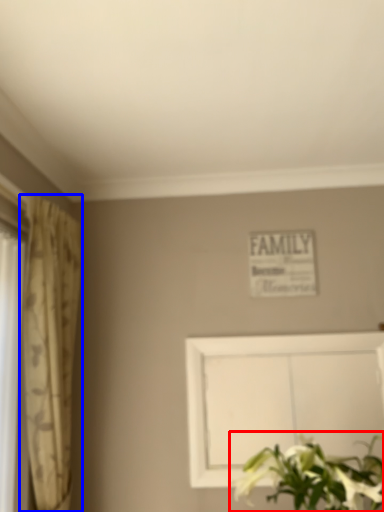
Question: Which object is further to the camera taking this photo, floral arrangement (highlighted by a red box) or curtain (highlighted by a blue box)?

Choices:
 (A) floral arrangement
 (B) curtain

Answer: (B)